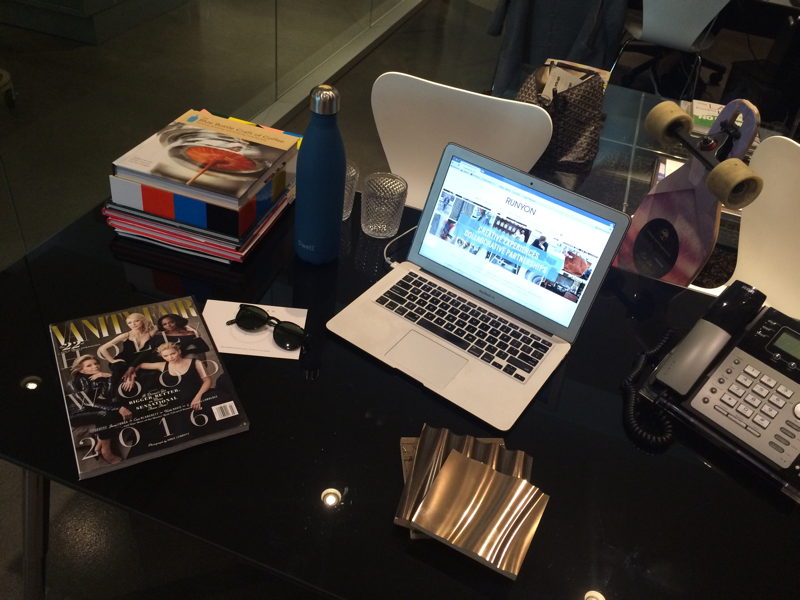
You are a GUI agent. You are given a task and a screenshot of the screen. Output one action in this format:
    pyautogui.click(x=<x>, y=<y>)
    Task: Click on the bottle
    
    Given the screenshot: What is the action you would take?
    pyautogui.click(x=326, y=174)